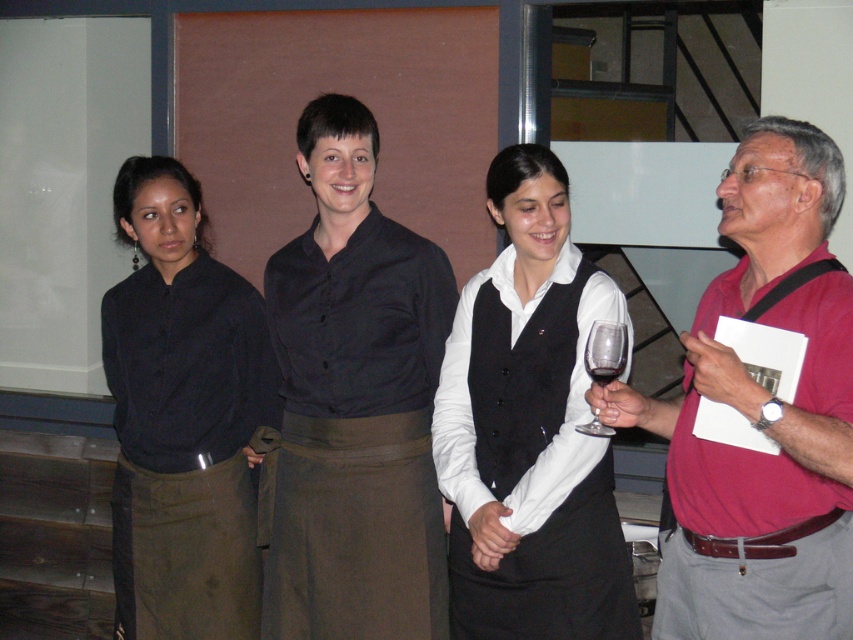
Is point (421, 584) positioned before point (782, 488)?

No, it is behind (782, 488).

Looking at this image, can you confirm if black satin shirt at center is shorter than pink matte shirt at right?

No, black satin shirt at center is not shorter than pink matte shirt at right.

Is point (422, 273) in front of point (793, 268)?

That is False.

Locate an element on the screen. The height and width of the screenshot is (640, 853). black satin shirt at center is located at coordinates (355, 403).

Can you confirm if black satin shirt at center is positioned above red glass at center?

No, black satin shirt at center is not above red glass at center.

Measure the distance from black satin shirt at center to red glass at center.

They are 33.26 inches apart.

Where is `black satin shirt at center`? black satin shirt at center is located at coordinates (355, 403).

In the scene shown: Between black matte shirt at left and transparent glass at right, which one is positioned lower?

black matte shirt at left is lower down.

Can you confirm if black matte shirt at left is taller than transparent glass at right?

Indeed, black matte shirt at left has a greater height compared to transparent glass at right.

You are a GUI agent. You are given a task and a screenshot of the screen. Output one action in this format:
    pyautogui.click(x=<x>, y=<y>)
    Task: Click on the black matte shirt at left
    The height and width of the screenshot is (640, 853).
    Given the screenshot: What is the action you would take?
    pyautogui.click(x=183, y=417)